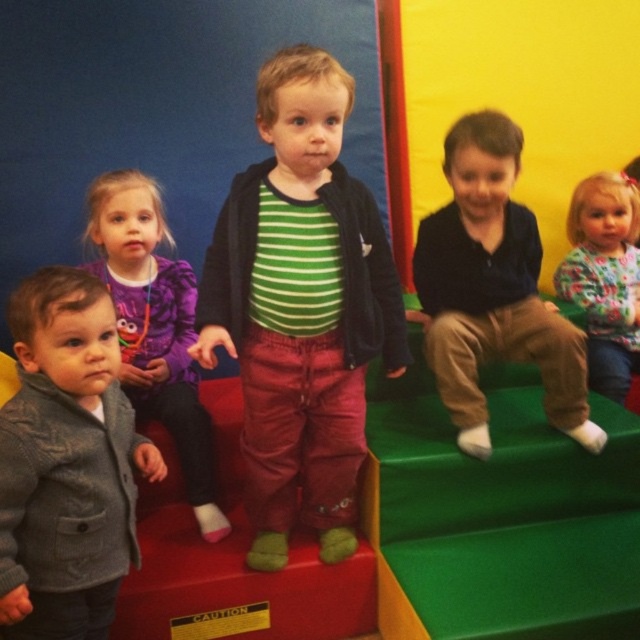
You are standing at the position of point (593,195) and want to move to the position of point (465,179). Is the path directly in front of you clear?

Yes, the path is clear because point (465,179) is in front of point (593,195), indicating there are no obstructions between them.

You are a photographer trying to capture a photo of the dark blue shirt at upper right and the floral fabric dress at upper right. Since the two objects are both at the upper right, which one is closer to the camera?

The dark blue shirt at upper right is positioned under the floral fabric dress at upper right, so the floral fabric dress at upper right is closer to the camera.